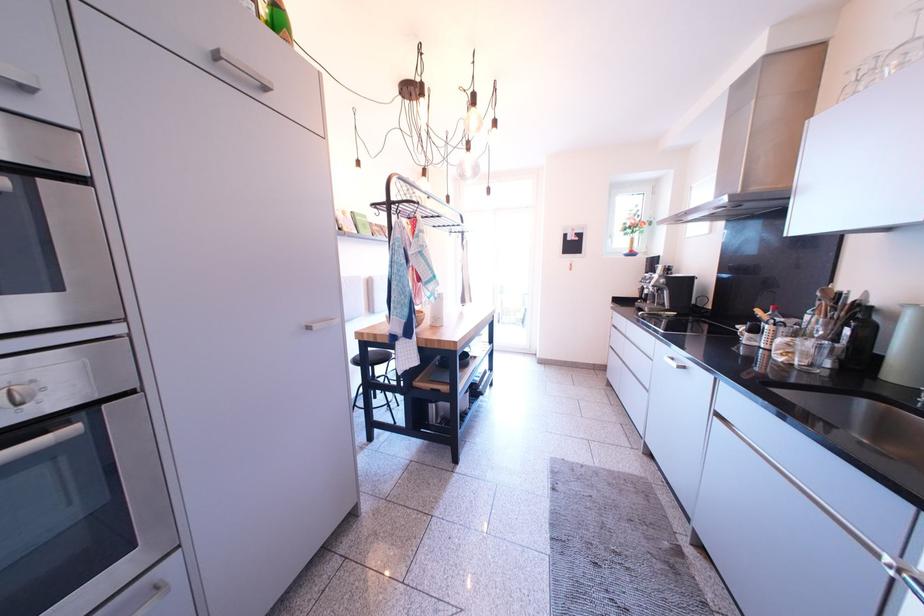
Identify the location of silver cabinet handle. This screenshot has height=616, width=924. (674, 362).